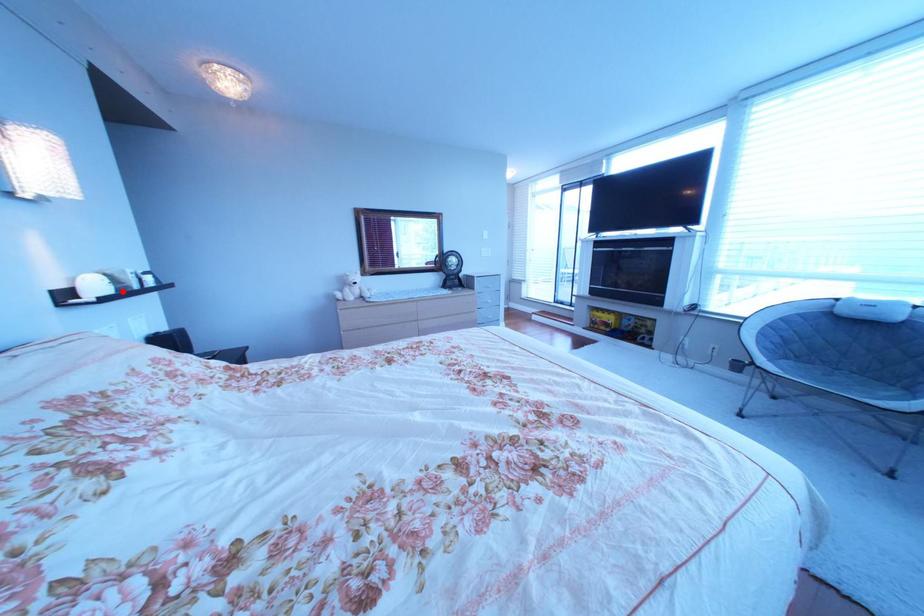
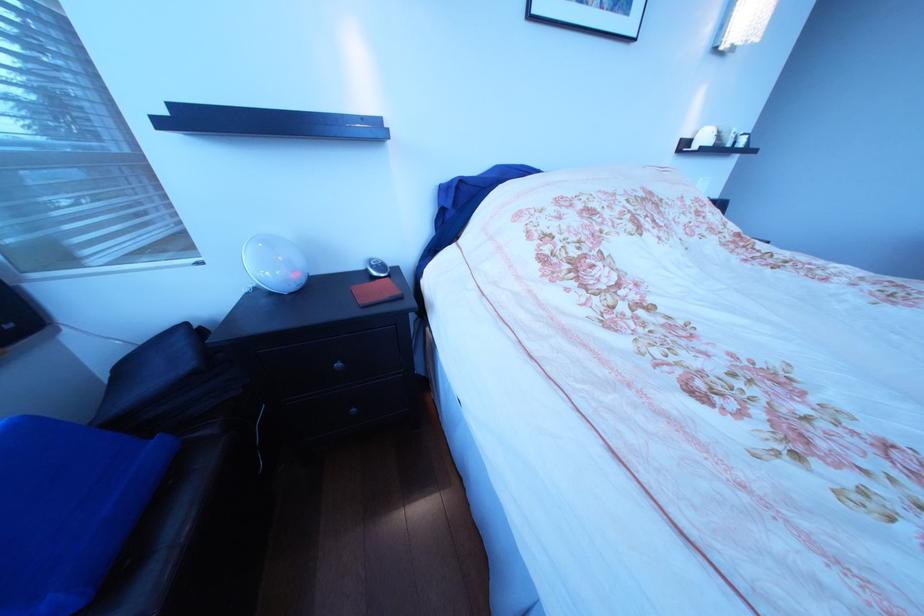
The point at the highlighted location is marked in the first image. Where is the corresponding point in the second image?

(724, 146)